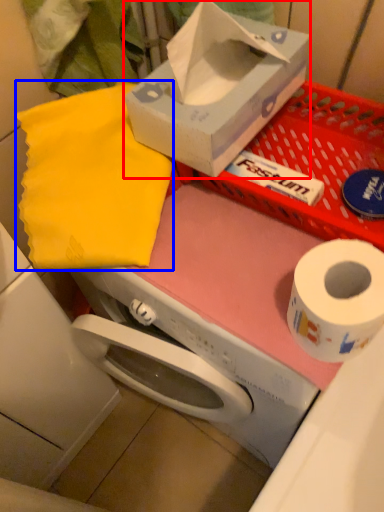
Question: Which of the following is the closest to the observer, box (highlighted by a red box) or cloth (highlighted by a blue box)?

Choices:
 (A) box
 (B) cloth

Answer: (A)